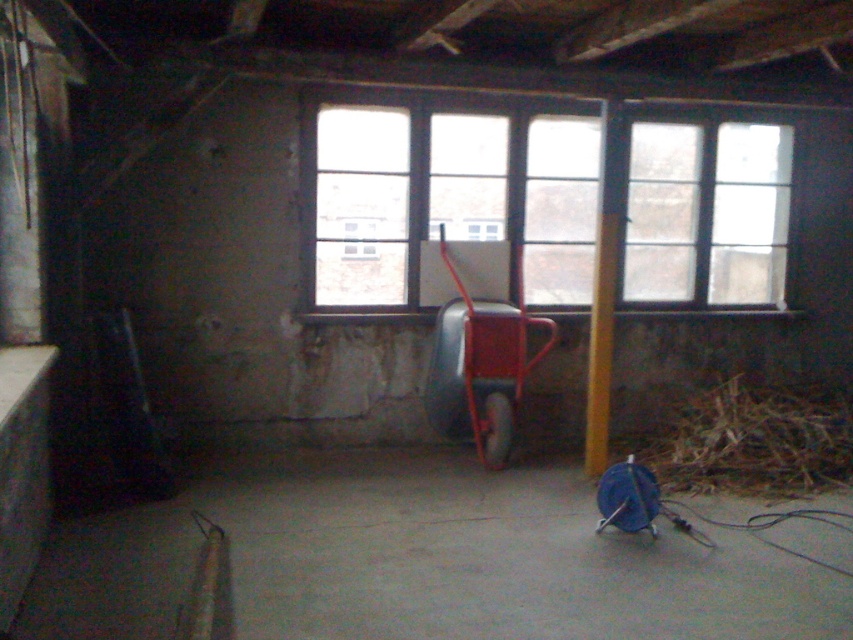
How far apart are clear glass window at upper center and brown dry hay at lower right?

clear glass window at upper center is 4.32 feet away from brown dry hay at lower right.

What are the coordinates of `clear glass window at upper center` in the screenshot? It's located at (708, 212).

Identify the location of clear glass window at upper center. (708, 212).

Based on the photo, who is shorter, clear glass window at center or yellow wood pole at center?

clear glass window at center is shorter.

Is clear glass window at center positioned before yellow wood pole at center?

No, clear glass window at center is further to the viewer.

Find the location of `clear glass window at center`. clear glass window at center is located at coordinates pos(451,202).

Image resolution: width=853 pixels, height=640 pixels. Find the location of `clear glass window at center`. clear glass window at center is located at coordinates (451, 202).

Between clear glass window at upper center and yellow wood pole at center, which one has more height?

With more height is yellow wood pole at center.

Who is lower down, clear glass window at upper center or yellow wood pole at center?

yellow wood pole at center is lower down.

Is point (735, 241) positioned before point (595, 273)?

No, it is behind (595, 273).

Find the location of a particular element. clear glass window at upper center is located at coordinates (708, 212).